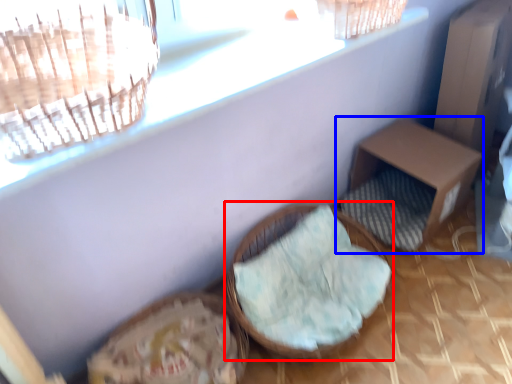
Question: Which point is further to the camera, furniture (highlighted by a red box) or furniture (highlighted by a blue box)?

Choices:
 (A) furniture
 (B) furniture

Answer: (B)